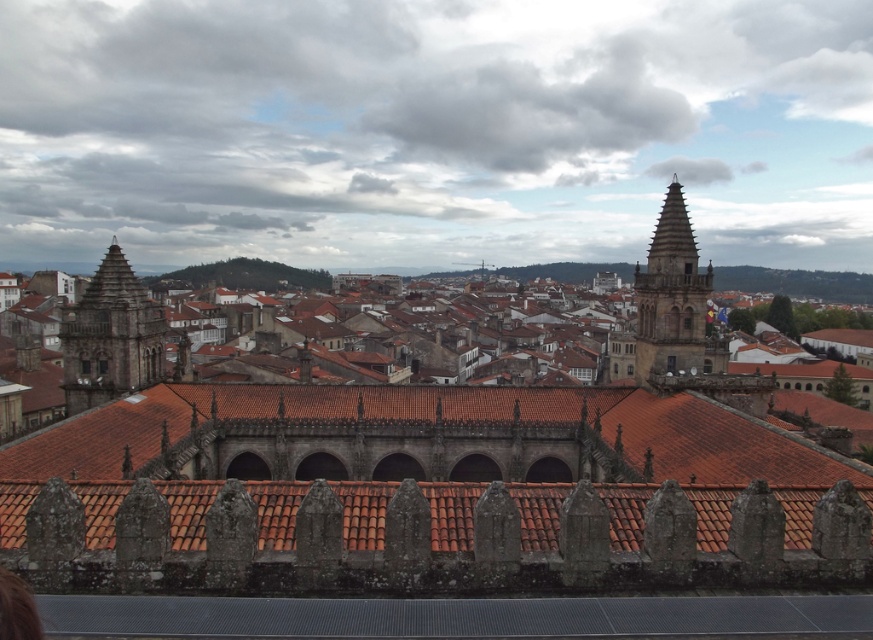
Question: Does dark brown stone tower at left have a smaller size compared to brown stone tower at upper right?

Choices:
 (A) no
 (B) yes

Answer: (B)

Question: Among these objects, which one is nearest to the camera?

Choices:
 (A) brown stone tower at upper right
 (B) dark brown stone tower at left

Answer: (A)

Question: Which point is closer to the camera?

Choices:
 (A) (143, 374)
 (B) (459, 397)

Answer: (B)

Question: Does dark brown stone tower at left have a larger size compared to brown stone tower at upper right?

Choices:
 (A) no
 (B) yes

Answer: (A)

Question: Which of the following is the farthest from the observer?

Choices:
 (A) brown stone tower at upper right
 (B) red tile roof at center
 (C) dark brown stone tower at left

Answer: (C)

Question: Is red tile roof at center closer to the viewer compared to dark brown stone tower at left?

Choices:
 (A) no
 (B) yes

Answer: (B)